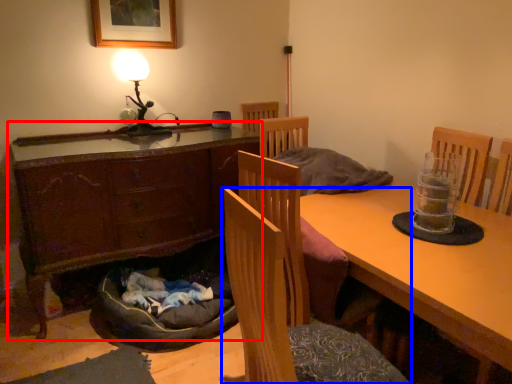
Question: Which point is further to the camera, cabinetry (highlighted by a red box) or chair (highlighted by a blue box)?

Choices:
 (A) cabinetry
 (B) chair

Answer: (A)